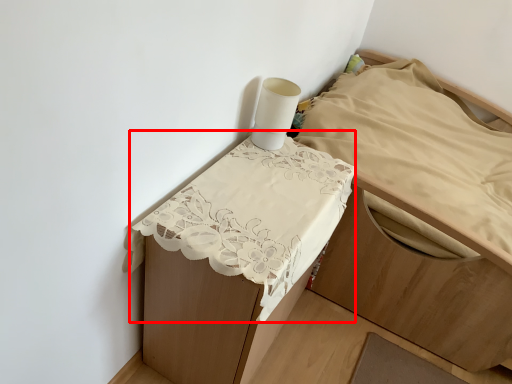
Question: From the image's perspective, where is sheet (annotated by the red box) located relative to furniture?

Choices:
 (A) below
 (B) above

Answer: (A)